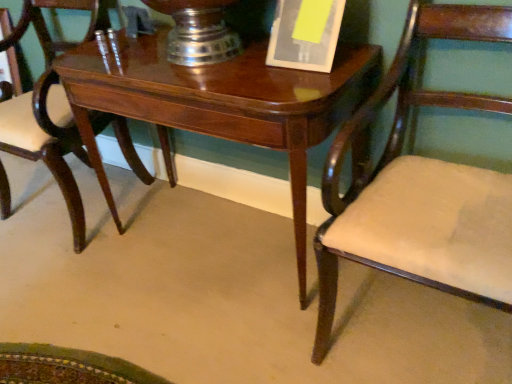
Locate an element on the screen. Image resolution: width=512 pixels, height=384 pixels. free spot to the left of yellow paper at upper center is located at coordinates (241, 68).